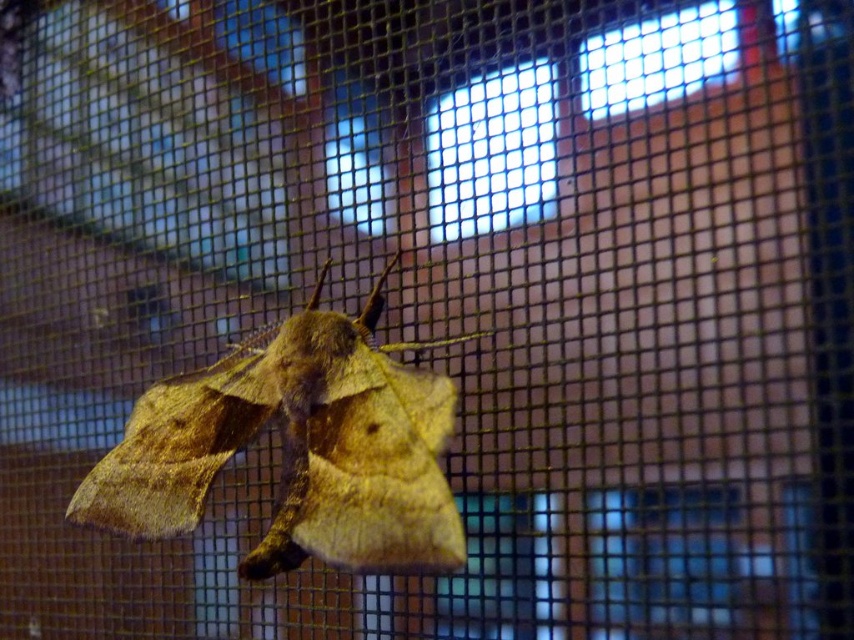
Question: Can you confirm if fuzzy brown moth at center is wider than transparent glass window at upper center?

Choices:
 (A) no
 (B) yes

Answer: (B)

Question: Is fuzzy brown moth at center closer to the viewer compared to transparent glass window at upper center?

Choices:
 (A) no
 (B) yes

Answer: (B)

Question: Is fuzzy brown moth at center thinner than transparent glass window at upper center?

Choices:
 (A) yes
 (B) no

Answer: (B)

Question: Which point appears farthest from the camera in this image?

Choices:
 (A) (284, 529)
 (B) (528, 164)

Answer: (B)